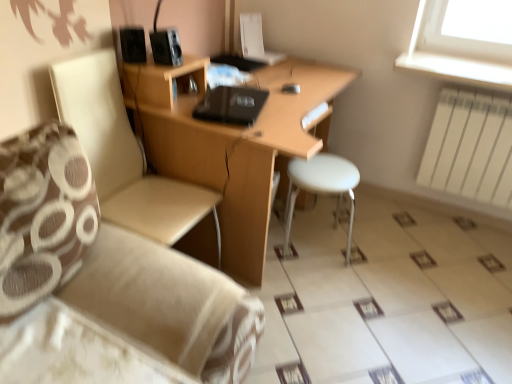
Question: Considering the positions of black matte speaker at upper left, acting as the first speaker starting from the left, and wooden desk at center in the image, is black matte speaker at upper left, acting as the first speaker starting from the left, wider or thinner than wooden desk at center?

Choices:
 (A) thin
 (B) wide

Answer: (A)

Question: In terms of size, does black matte speaker at upper left, which is the 2th speaker in right-to-left order, appear bigger or smaller than wooden desk at center?

Choices:
 (A) big
 (B) small

Answer: (B)

Question: Estimate the real-world distances between objects in this image. Which object is closer to the beige fabric couch at lower left?

Choices:
 (A) black matte speaker at upper left, which is the 2th speaker in right-to-left order
 (B) wooden desk at center
 (C) black plastic speaker at upper center, marked as the 1th speaker in a right-to-left arrangement
 (D) white metal radiator at right
 (E) white plastic stool at center

Answer: (B)

Question: Estimate the real-world distances between objects in this image. Which object is closer to the beige fabric chair at left?

Choices:
 (A) black matte laptop at center
 (B) beige fabric couch at lower left
 (C) white metal radiator at right
 (D) wooden desk at center
 (E) white plastic stool at center

Answer: (D)